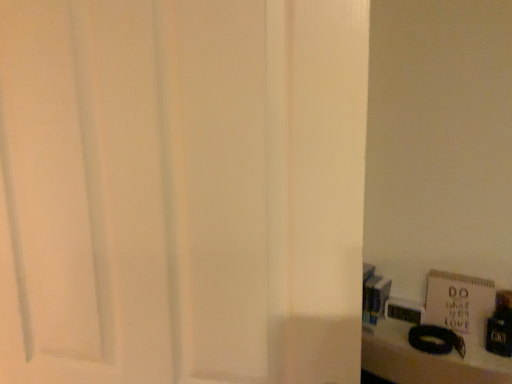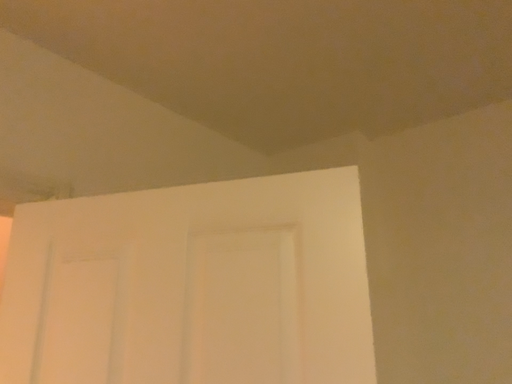
Question: How did the camera likely rotate when shooting the video?

Choices:
 (A) rotated upward
 (B) rotated downward

Answer: (A)